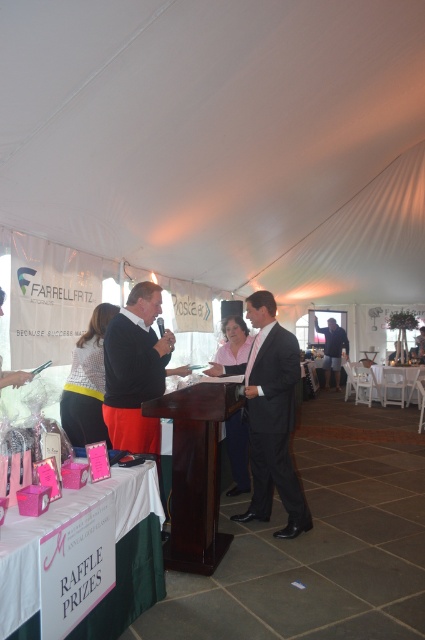
Between orange knit sweater at center and pink fabric at center, which one has less height?

Standing shorter between the two is pink fabric at center.

Does point (129, 317) come closer to viewer compared to point (226, 324)?

That is True.

The image size is (425, 640). Find the location of `orange knit sweater at center`. orange knit sweater at center is located at coordinates (136, 372).

Is wooden podium at center in front of light brown leather jacket at center?

Yes.

Can you confirm if wooden podium at center is positioned to the left of light brown leather jacket at center?

Indeed, wooden podium at center is positioned on the left side of light brown leather jacket at center.

Identify the location of wooden podium at center. This screenshot has width=425, height=640. (195, 472).

The height and width of the screenshot is (640, 425). What are the coordinates of `wooden podium at center` in the screenshot? It's located at (195, 472).

Which is in front, point (105, 417) or point (377, 390)?

Point (105, 417)

Which is more to the right, orange knit sweater at center or white glossy table at lower right?

From the viewer's perspective, white glossy table at lower right appears more on the right side.

This screenshot has height=640, width=425. Describe the element at coordinates (136, 372) in the screenshot. I see `orange knit sweater at center` at that location.

This screenshot has height=640, width=425. Identify the location of orange knit sweater at center. (136, 372).